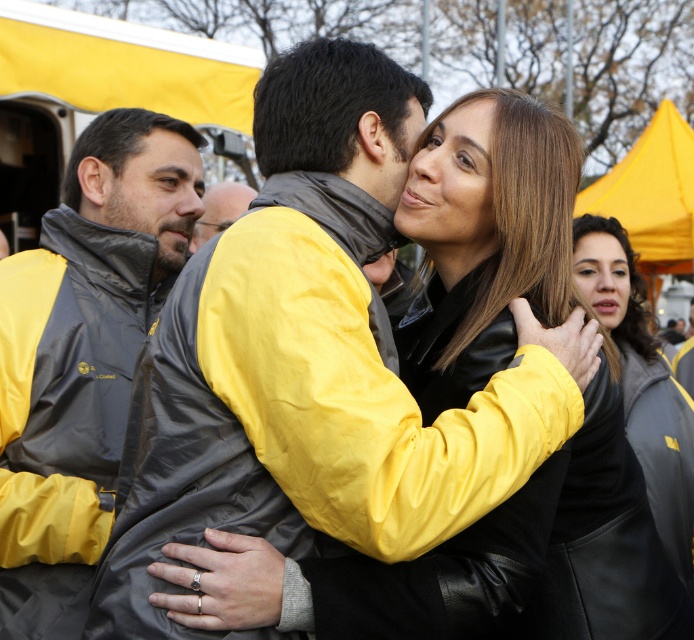
The image size is (694, 640). Find the location of `matte black jacket at left`. matte black jacket at left is located at coordinates (83, 355).

Between matte black jacket at left and black leather jacket at center, which one is positioned higher?

matte black jacket at left

Identify the location of matte black jacket at left. (83, 355).

Locate an element on the screen. The width and height of the screenshot is (694, 640). matte black jacket at left is located at coordinates (83, 355).

Which is behind, point (657, 436) or point (228, 218)?

Positioned behind is point (228, 218).

Looking at this image, who is taller, black leather jacket at center or yellow matte jacket at center?

black leather jacket at center

Which is behind, point (607, 234) or point (251, 189)?

The point (251, 189) is behind.

The height and width of the screenshot is (640, 694). Identify the location of black leather jacket at center. (641, 381).

Is matte black jacket at left to the left of yellow matte jacket at center from the viewer's perspective?

Yes, matte black jacket at left is to the left of yellow matte jacket at center.

Is matte black jacket at left positioned in front of yellow matte jacket at center?

Yes, matte black jacket at left is in front of yellow matte jacket at center.

Does point (49, 563) lie in front of point (223, 198)?

Yes.

Identify the location of matte black jacket at left. The image size is (694, 640). (83, 355).